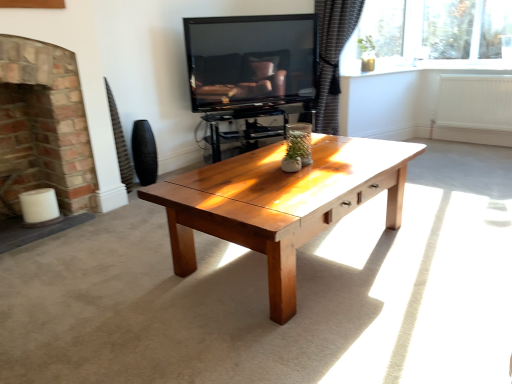
Question: From a real-world perspective, is matte black tv at upper center physically below black matte vase at left?

Choices:
 (A) no
 (B) yes

Answer: (A)

Question: Considering the relative sizes of matte black tv at upper center and black matte vase at left in the image provided, is matte black tv at upper center thinner than black matte vase at left?

Choices:
 (A) yes
 (B) no

Answer: (B)

Question: Is matte black tv at upper center positioned behind black matte vase at left?

Choices:
 (A) no
 (B) yes

Answer: (A)

Question: Would you say matte black tv at upper center is a long distance from black matte vase at left?

Choices:
 (A) yes
 (B) no

Answer: (A)

Question: Is matte black tv at upper center to the left of black matte vase at left from the viewer's perspective?

Choices:
 (A) yes
 (B) no

Answer: (B)

Question: Do you think brick fireplace at left is within white painted radiator at right, or outside of it?

Choices:
 (A) inside
 (B) outside

Answer: (B)

Question: Relative to white painted radiator at right, is brick fireplace at left in front or behind?

Choices:
 (A) behind
 (B) front

Answer: (B)

Question: Based on their sizes in the image, would you say brick fireplace at left is bigger or smaller than white painted radiator at right?

Choices:
 (A) big
 (B) small

Answer: (A)

Question: Is brick fireplace at left wider or thinner than white painted radiator at right?

Choices:
 (A) thin
 (B) wide

Answer: (B)

Question: From a real-world perspective, is white painted radiator at right above or below matte black tv at upper center?

Choices:
 (A) above
 (B) below

Answer: (B)

Question: Considering the positions of point (498, 82) and point (206, 82), is point (498, 82) closer or farther from the camera than point (206, 82)?

Choices:
 (A) closer
 (B) farther

Answer: (B)

Question: Is white painted radiator at right to the left or to the right of matte black tv at upper center in the image?

Choices:
 (A) right
 (B) left

Answer: (A)

Question: From the image's perspective, is white painted radiator at right positioned above or below matte black tv at upper center?

Choices:
 (A) above
 (B) below

Answer: (B)

Question: Is white painted radiator at right to the left or to the right of dark textured curtain at upper right in the image?

Choices:
 (A) right
 (B) left

Answer: (A)

Question: From a real-world perspective, relative to dark textured curtain at upper right, is white painted radiator at right vertically above or below?

Choices:
 (A) below
 (B) above

Answer: (A)